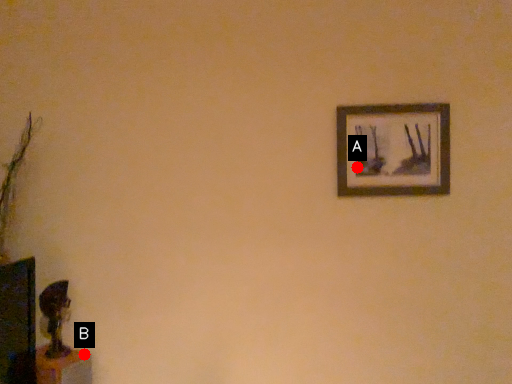
Question: Two points are circled on the image, labeled by A and B beside each circle. Which point appears farthest from the camera in this image?

Choices:
 (A) A is further
 (B) B is further

Answer: (A)